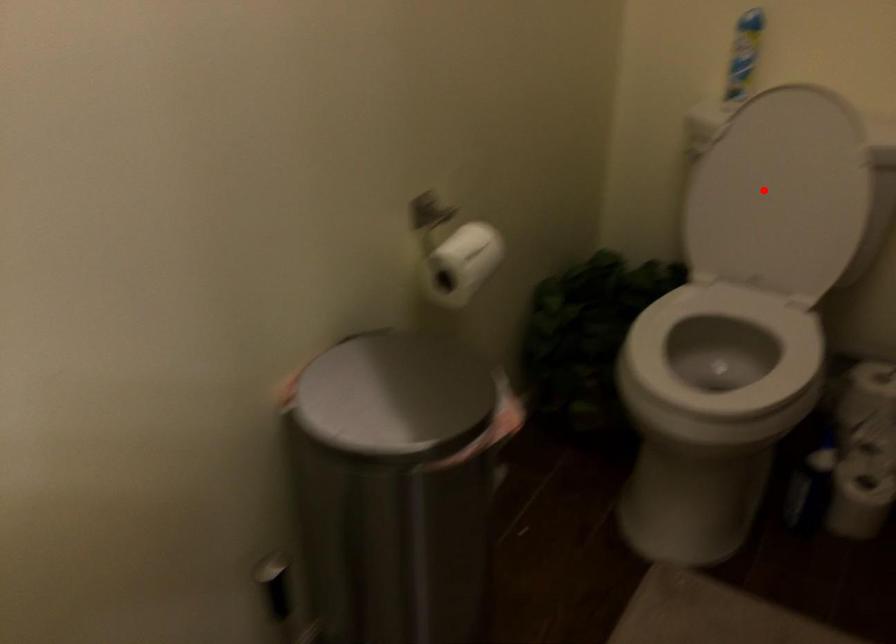
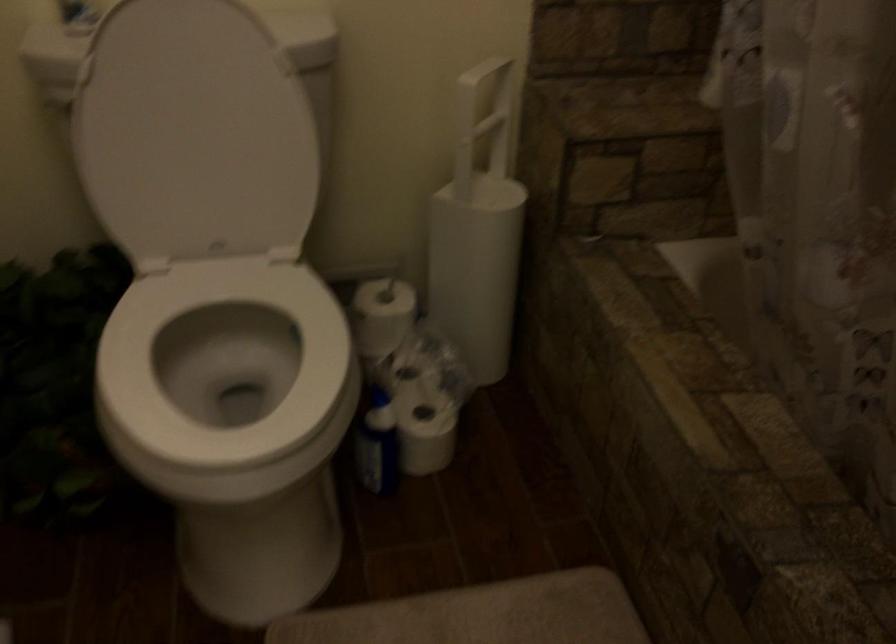
Find the pixel in the second image that matches the highlighted location in the first image.

(194, 134)